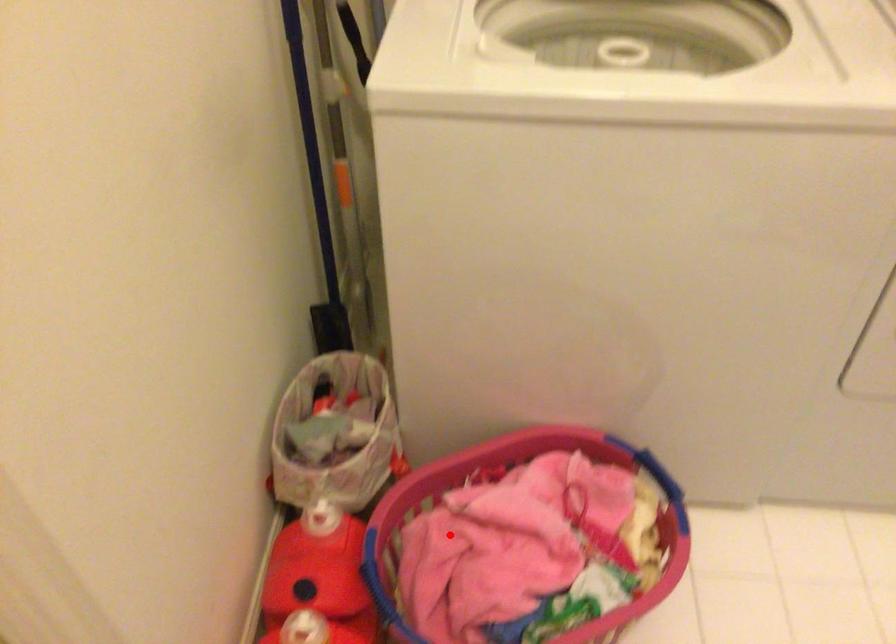
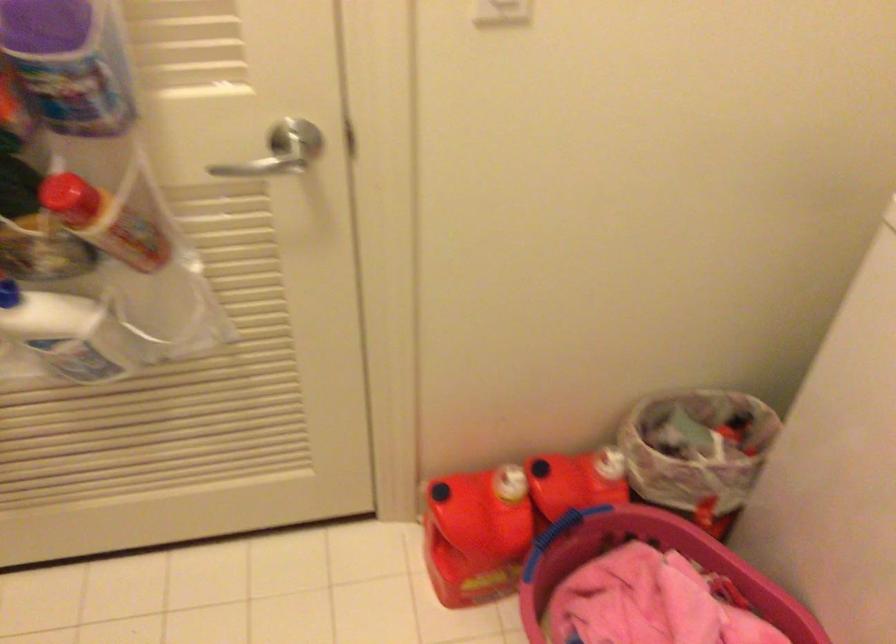
Find the pixel in the second image that matches the highlighted location in the first image.

(647, 565)